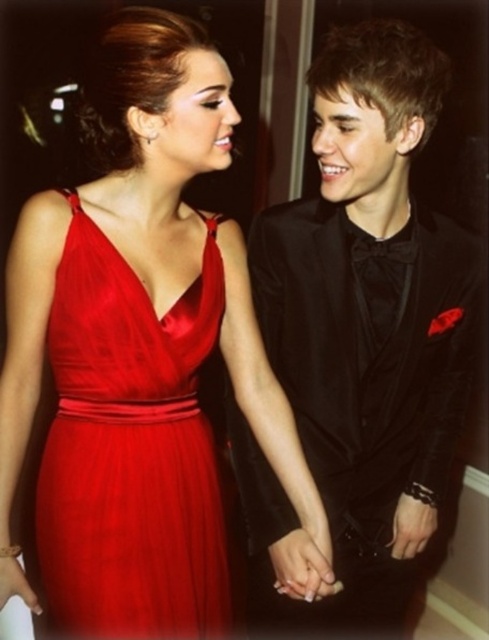
You are standing at the point labeled as point [419,365] and want to take a photo of the two people in the scene. If your camera is 1.36 meters away from you, will you be able to capture both individuals in the frame?

Yes, since the distance between point [419,365] and the camera is exactly 1.36 meters, which means the camera is positioned at that point. Therefore, you can capture both individuals in the frame as they are within the scene.

You are a photographer at a formal event. You need to position the satin dress at center and the black satin suit at center in such a way that they are both visible in the frame. Considering their sizes, which object should be placed closer to the camera to ensure both are fully visible?

The satin dress at center is smaller in size compared to the black satin suit at center, so placing the satin dress at center closer to the camera will help ensure both are fully visible in the frame.